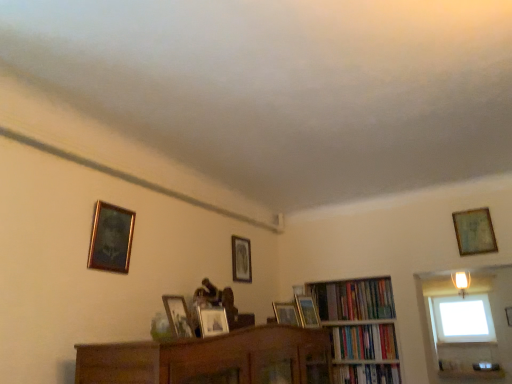
Consider the image. How much space does wooden picture frame at upper right, the 2th picture frame positioned from the back, occupy horizontally?

It is 1.61 inches.

The height and width of the screenshot is (384, 512). What do you see at coordinates (367, 374) in the screenshot? I see `hardcover book at center-right, acting as the 1th book starting from the bottom` at bounding box center [367, 374].

Identify the location of gold-framed picture at center, positioned as the 6th picture frame in front-to-back order. (241, 259).

The image size is (512, 384). What do you see at coordinates (364, 342) in the screenshot?
I see `hardcover books at center, placed as the 2th book when sorted from top to bottom` at bounding box center [364, 342].

The image size is (512, 384). Identify the location of wooden bookcase at center. (360, 328).

Where is `wooden picture frame at center, which ranks as the 3th picture frame in right-to-left order`? This screenshot has height=384, width=512. wooden picture frame at center, which ranks as the 3th picture frame in right-to-left order is located at coordinates (286, 313).

In the scene shown: From a real-world perspective, is wooden bookcase at center above or below wooden photo frame at center, which is counted as the fifth picture frame, starting from the right?

wooden bookcase at center is below wooden photo frame at center, which is counted as the fifth picture frame, starting from the right.

Considering the relative positions of wooden bookcase at center and wooden photo frame at center, marked as the 1th picture frame in a front-to-back arrangement, in the image provided, is wooden bookcase at center to the left of wooden photo frame at center, marked as the 1th picture frame in a front-to-back arrangement, from the viewer's perspective?

No.

Measure the distance from wooden bookcase at center to wooden photo frame at center, marked as the 1th picture frame in a front-to-back arrangement.

1.59 meters.

Considering the relative sizes of wooden bookcase at center and wooden photo frame at center, the second picture frame when ordered from left to right, in the image provided, is wooden bookcase at center wider than wooden photo frame at center, the second picture frame when ordered from left to right,?

Yes.

Considering the sizes of wooden picture frame at upper center, the 3th picture frame from the back, and wooden bookcase at center in the image, is wooden picture frame at upper center, the 3th picture frame from the back, wider or thinner than wooden bookcase at center?

Clearly, wooden picture frame at upper center, the 3th picture frame from the back, has less width compared to wooden bookcase at center.

Does point (297, 308) appear closer or farther from the camera than point (380, 368)?

Point (297, 308) is closer to the camera than point (380, 368).

From a real-world perspective, is wooden picture frame at upper center, the 3th picture frame from the back, above or below wooden bookcase at center?

wooden picture frame at upper center, the 3th picture frame from the back, is situated higher than wooden bookcase at center in the real world.

Could you tell me if wooden picture frame at upper center, the 3th picture frame from the back, is turned towards wooden bookcase at center?

No, wooden picture frame at upper center, the 3th picture frame from the back, is not oriented towards wooden bookcase at center.

Is point (281, 318) in front of point (359, 299)?

That is True.

From a real-world perspective, is wooden picture frame at center, which appears as the 3th picture frame when viewed from the front, physically above hardcover books at upper right, the first book positioned from the top?

No, from a real-world perspective, wooden picture frame at center, which appears as the 3th picture frame when viewed from the front, is not on top of hardcover books at upper right, the first book positioned from the top.

How different are the orientations of wooden picture frame at center, which ranks as the 3th picture frame in right-to-left order, and hardcover books at upper right, the first book positioned from the top, in degrees?

85.2 degrees separate the facing orientations of wooden picture frame at center, which ranks as the 3th picture frame in right-to-left order, and hardcover books at upper right, the first book positioned from the top.

Is wooden picture frame at center, positioned as the fourth picture frame in back-to-front order, far away from hardcover books at upper right, the 3th book ordered from the bottom?

No, wooden picture frame at center, positioned as the fourth picture frame in back-to-front order, is not far away from hardcover books at upper right, the 3th book ordered from the bottom.

Is hardcover books at upper right, the 3th book ordered from the bottom, positioned far away from transparent glass window at upper right?

That's not correct — hardcover books at upper right, the 3th book ordered from the bottom, is a little close to transparent glass window at upper right.

How distant is hardcover books at upper right, the 3th book ordered from the bottom, from transparent glass window at upper right?

hardcover books at upper right, the 3th book ordered from the bottom, and transparent glass window at upper right are 48.01 centimeters apart.

Is hardcover books at upper right, the 3th book ordered from the bottom, inside or outside of transparent glass window at upper right?

hardcover books at upper right, the 3th book ordered from the bottom, lies outside transparent glass window at upper right.

From the image's perspective, starting from the wooden bookcase at center, which picture frame is the 3rd one above? Please provide its 2D coordinates.

[(241, 259)]

Is gold-framed picture at center, arranged as the 1th picture frame when viewed from the back, thinner than wooden bookcase at center?

Indeed, gold-framed picture at center, arranged as the 1th picture frame when viewed from the back, has a lesser width compared to wooden bookcase at center.

What's the angular difference between gold-framed picture at center, placed as the 4th picture frame when sorted from right to left, and wooden bookcase at center's facing directions?

The angle between the facing direction of gold-framed picture at center, placed as the 4th picture frame when sorted from right to left, and the facing direction of wooden bookcase at center is 94.7 degrees.

Is gold-framed picture at center, the third picture frame from the left, far away from wooden bookcase at center?

No.

Is wooden bookcase at center spatially inside transparent glass window at upper right, or outside of it?

wooden bookcase at center is located beyond the bounds of transparent glass window at upper right.

Is wooden bookcase at center behind transparent glass window at upper right?

No, wooden bookcase at center is closer to the viewer.

Is there a large distance between wooden bookcase at center and transparent glass window at upper right?

wooden bookcase at center is near transparent glass window at upper right, not far away.

Which is behind, point (365, 362) or point (458, 302)?

Point (365, 362)

Is hardcover book at center-right, which ranks as the 3th book in top-to-bottom order, in contact with gold-framed painting at upper left, arranged as the fifth picture frame when viewed from the back?

hardcover book at center-right, which ranks as the 3th book in top-to-bottom order, and gold-framed painting at upper left, arranged as the fifth picture frame when viewed from the back, are not in contact.

Does hardcover book at center-right, acting as the 1th book starting from the bottom, have a larger size compared to gold-framed painting at upper left, which appears as the second picture frame when viewed from the front?

Correct, hardcover book at center-right, acting as the 1th book starting from the bottom, is larger in size than gold-framed painting at upper left, which appears as the second picture frame when viewed from the front.

Which is correct: hardcover book at center-right, which ranks as the 3th book in top-to-bottom order, is inside gold-framed painting at upper left, marked as the first picture frame in a left-to-right arrangement, or outside of it?

hardcover book at center-right, which ranks as the 3th book in top-to-bottom order, is not enclosed by gold-framed painting at upper left, marked as the first picture frame in a left-to-right arrangement.

From the image's perspective, which one is positioned higher, hardcover book at center-right, acting as the 1th book starting from the bottom, or gold-framed painting at upper left, arranged as the fifth picture frame when viewed from the back?

gold-framed painting at upper left, arranged as the fifth picture frame when viewed from the back, from the image's perspective.

At what (x,y) coordinates should I click in order to perform the action: click on bookcase that is on the right side of wooden photo frame at center, which is the sixth picture frame in back-to-front order. Please return your answer as a coordinate pair (x, y). Looking at the image, I should click on (360, 328).

Where is `bookcase located below the wooden picture frame at upper center, positioned as the fifth picture frame in left-to-right order (from the image's perspective)`? This screenshot has height=384, width=512. bookcase located below the wooden picture frame at upper center, positioned as the fifth picture frame in left-to-right order (from the image's perspective) is located at coordinates (360, 328).

Looking at the image, which one is located closer to gold-framed painting at upper left, the sixth picture frame viewed from the right, hardcover books at center, placed as the 2th book when sorted from top to bottom, or wooden photo frame at center, the second picture frame when ordered from left to right?

wooden photo frame at center, the second picture frame when ordered from left to right.

Based on their spatial positions, is wooden picture frame at center, arranged as the 4th picture frame when viewed from the left, or hardcover books at upper right, the 3th book ordered from the bottom, further from transparent glass window at upper right?

wooden picture frame at center, arranged as the 4th picture frame when viewed from the left, is positioned further to the anchor transparent glass window at upper right.

Looking at the image, which one is located further to hardcover book at center-right, acting as the 1th book starting from the bottom, wooden photo frame at center, the second picture frame when ordered from left to right, or hardcover books at center, the second book in the bottom-to-top sequence?

wooden photo frame at center, the second picture frame when ordered from left to right, is positioned further to the anchor hardcover book at center-right, acting as the 1th book starting from the bottom.

Considering their positions, is wooden picture frame at center, which appears as the 3th picture frame when viewed from the front, positioned closer to wooden picture frame at upper center, positioned as the fifth picture frame in left-to-right order, than transparent glass window at upper right?

wooden picture frame at center, which appears as the 3th picture frame when viewed from the front, is positioned closer to the anchor wooden picture frame at upper center, positioned as the fifth picture frame in left-to-right order.

Consider the image. Looking at the image, which one is located further to wooden photo frame at center, which is counted as the fifth picture frame, starting from the right, gold-framed picture at center, arranged as the 1th picture frame when viewed from the back, or wooden bookcase at center?

The object further to wooden photo frame at center, which is counted as the fifth picture frame, starting from the right, is wooden bookcase at center.

Based on their spatial positions, is wooden picture frame at upper center, the 3th picture frame from the back, or wooden photo frame at center, which is counted as the fifth picture frame, starting from the right, further from wooden picture frame at upper right, the 5th picture frame viewed from the front?

wooden photo frame at center, which is counted as the fifth picture frame, starting from the right, lies further to wooden picture frame at upper right, the 5th picture frame viewed from the front, than the other object.

Considering their positions, is wooden picture frame at center, which ranks as the 3th picture frame in right-to-left order, positioned closer to transparent glass window at upper right than wooden picture frame at upper center, marked as the second picture frame in a right-to-left arrangement?

wooden picture frame at upper center, marked as the second picture frame in a right-to-left arrangement, is closer to transparent glass window at upper right.

From the image, which object appears to be nearer to transparent glass window at upper right, wooden picture frame at center, which ranks as the 3th picture frame in right-to-left order, or gold-framed painting at upper left, marked as the first picture frame in a left-to-right arrangement?

The object closer to transparent glass window at upper right is wooden picture frame at center, which ranks as the 3th picture frame in right-to-left order.

The image size is (512, 384). In order to click on bookcase located between wooden picture frame at center, positioned as the fourth picture frame in back-to-front order, and hardcover books at center, placed as the 2th book when sorted from top to bottom, in the left-right direction in this screenshot , I will do `click(360, 328)`.

Identify the location of book between wooden photo frame at center, the second picture frame when ordered from left to right, and hardcover books at center, placed as the 2th book when sorted from top to bottom, in the front-back direction. This screenshot has width=512, height=384. click(x=367, y=374).

Locate an element on the screen. This screenshot has height=384, width=512. bookcase situated between wooden picture frame at upper center, the 4th picture frame positioned from the front, and hardcover books at upper right, the first book positioned from the top, from left to right is located at coordinates (360, 328).

The width and height of the screenshot is (512, 384). In order to click on bookcase located between wooden photo frame at center, which is the sixth picture frame in back-to-front order, and hardcover books at upper right, the first book positioned from the top, in the depth direction in this screenshot , I will do `click(360, 328)`.